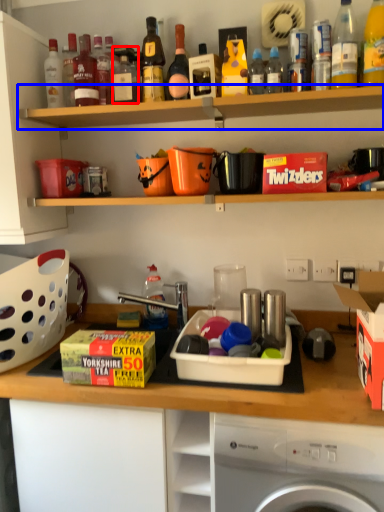
Question: Among these objects, which one is nearest to the camera, bottle (highlighted by a red box) or shelf (highlighted by a blue box)?

Choices:
 (A) bottle
 (B) shelf

Answer: (B)